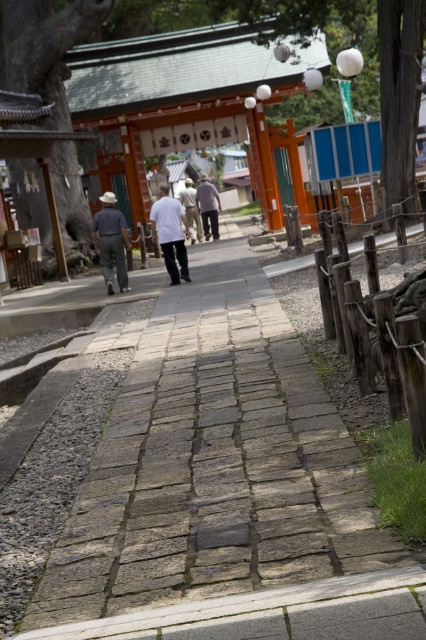
Question: Which point is farther to the camera?

Choices:
 (A) (213, 225)
 (B) (117, 237)
 (C) (405, 324)

Answer: (A)

Question: Can you confirm if light gray cotton pants at center is thinner than light brown fabric pants at center?

Choices:
 (A) yes
 (B) no

Answer: (B)

Question: Can you confirm if denim jacket at left is positioned above white matte shirt at center?

Choices:
 (A) no
 (B) yes

Answer: (A)

Question: Is denim jacket at left positioned behind white matte shirt at center?

Choices:
 (A) no
 (B) yes

Answer: (B)

Question: Which object is closer to the camera taking this photo?

Choices:
 (A) white matte shirt at center
 (B) light gray cotton pants at center
 (C) rustic wooden fence at right

Answer: (C)

Question: Which of the following is the closest to the observer?

Choices:
 (A) (180, 195)
 (B) (253, 451)
 (C) (365, 336)
 (D) (164, 221)

Answer: (B)